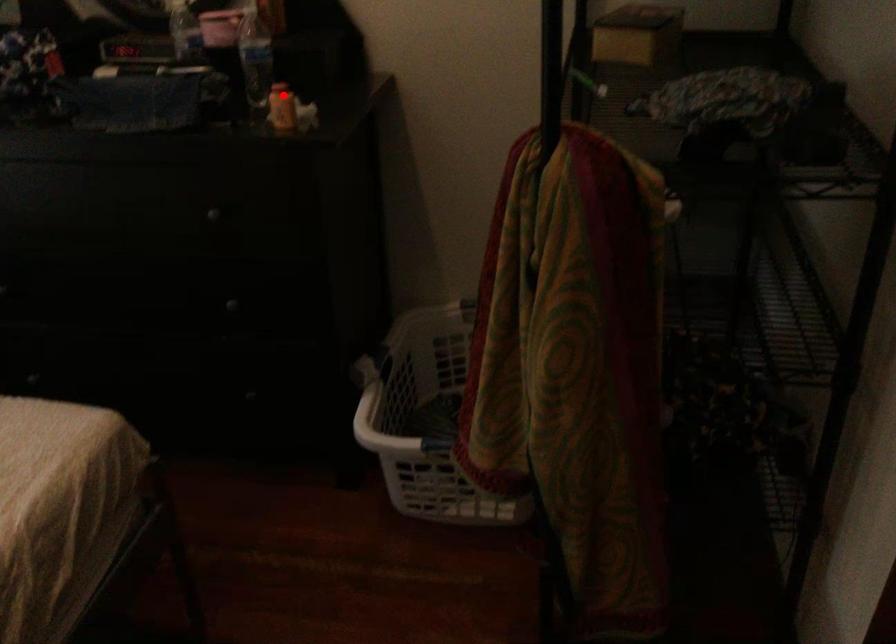
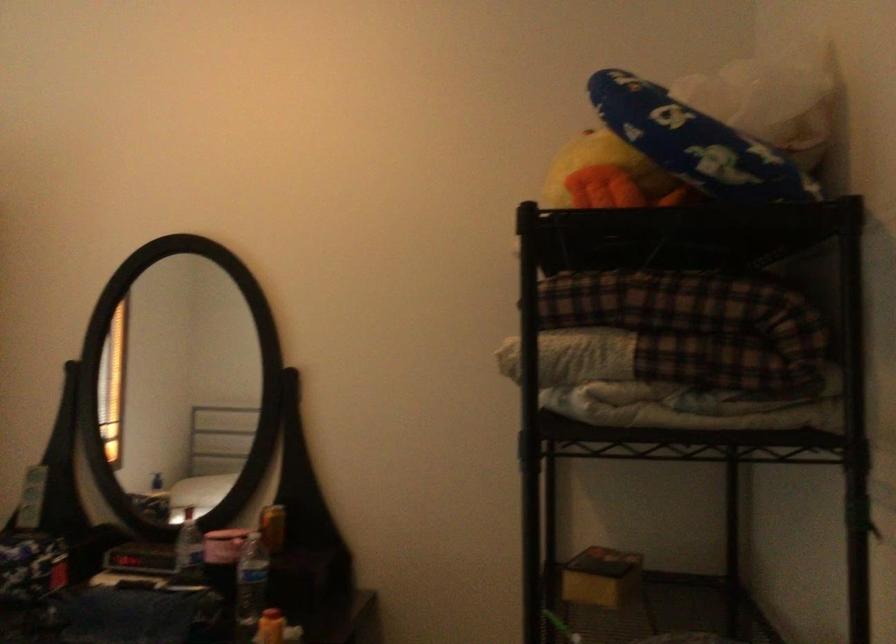
Find the pixel in the second image that matches the highlighted location in the first image.

(270, 627)